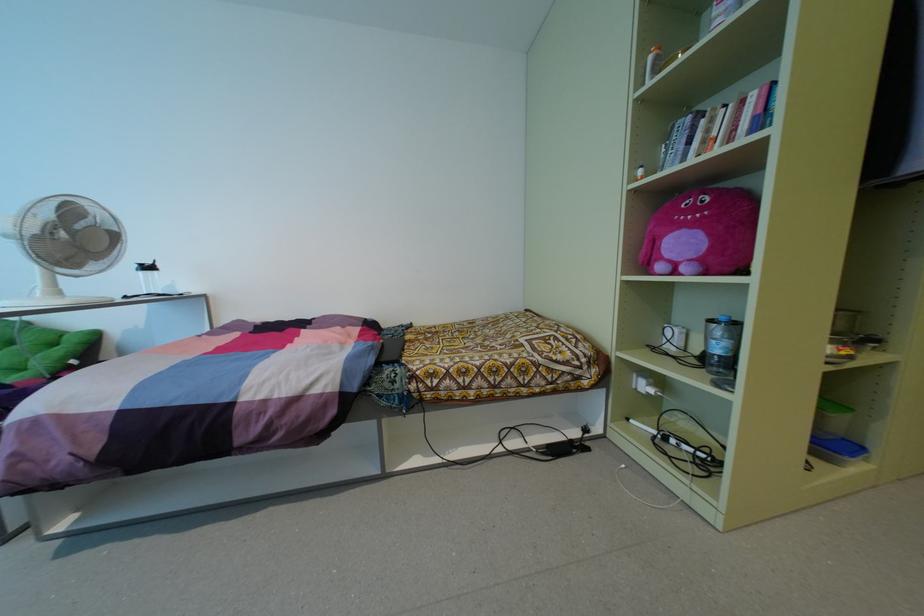
Describe the element at coordinates (726, 318) in the screenshot. I see `a blue bottle cap` at that location.